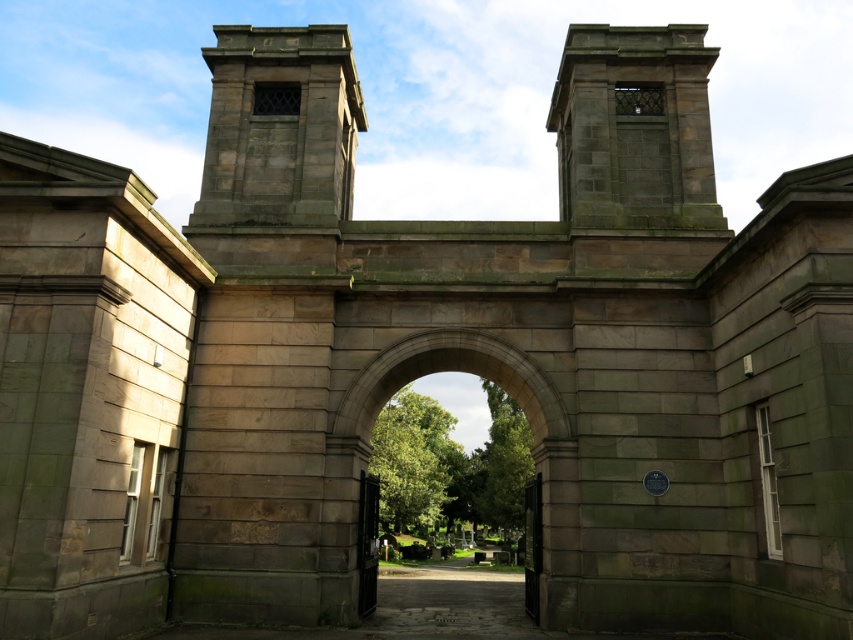
Can you confirm if stone archway at center is positioned to the right of polished dark green gate at center?

No, stone archway at center is not to the right of polished dark green gate at center.

Which is more to the right, stone archway at center or polished dark green gate at center?

polished dark green gate at center

This screenshot has height=640, width=853. What are the coordinates of `stone archway at center` in the screenshot? It's located at (462, 371).

Between stone archway at center and polished dark wood gate at center, which one is positioned higher?

stone archway at center is above.

Is stone archway at center behind polished dark wood gate at center?

No, stone archway at center is closer to the viewer.

Which is in front, point (358, 413) or point (363, 529)?

Point (358, 413) is more forward.

The width and height of the screenshot is (853, 640). I want to click on stone archway at center, so click(462, 371).

Who is positioned more to the right, polished dark wood gate at center or polished dark green gate at center?

From the viewer's perspective, polished dark green gate at center appears more on the right side.

Between polished dark wood gate at center and polished dark green gate at center, which one appears on the left side from the viewer's perspective?

polished dark wood gate at center is more to the left.

The image size is (853, 640). Find the location of `polished dark wood gate at center`. polished dark wood gate at center is located at coordinates pos(367,541).